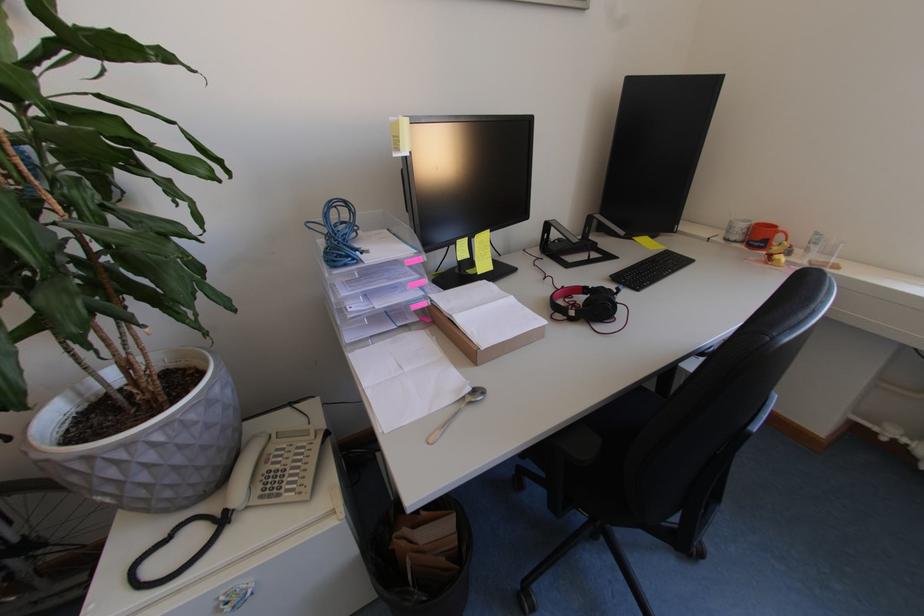
The width and height of the screenshot is (924, 616). What do you see at coordinates (483, 320) in the screenshot? I see `a small cardboard box` at bounding box center [483, 320].